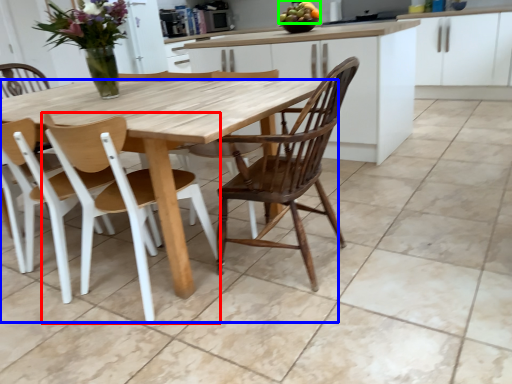
Question: Considering the real-world distances, which object is closest to chair (highlighted by a red box)? table (highlighted by a blue box) or fruit (highlighted by a green box).

Choices:
 (A) table
 (B) fruit

Answer: (A)